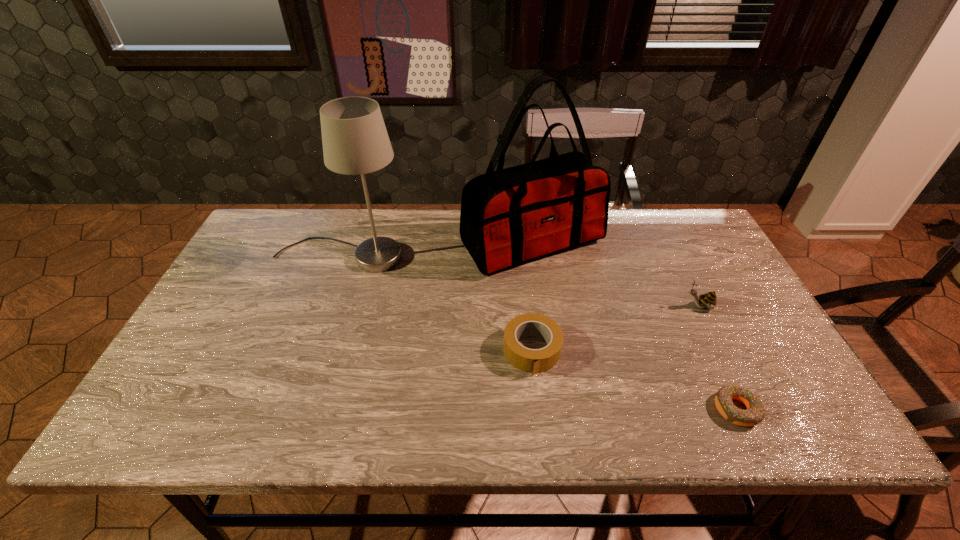
You are a GUI agent. You are given a task and a screenshot of the screen. Output one action in this format:
    pyautogui.click(x=<x>, y=<y>)
    Task: Click on the vacant position located on the face of the third nearest object
    The height and width of the screenshot is (540, 960).
    Given the screenshot: What is the action you would take?
    pyautogui.click(x=615, y=307)

Where is `vacant space located on the face of the third nearest object`? This screenshot has width=960, height=540. vacant space located on the face of the third nearest object is located at coordinates (x=560, y=307).

Image resolution: width=960 pixels, height=540 pixels. What are the coordinates of `vacant position located on the face of the third nearest object` in the screenshot? It's located at (586, 307).

Locate an element on the screen. This screenshot has height=540, width=960. free space located at the edge of the duct tape is located at coordinates (540, 425).

This screenshot has width=960, height=540. Identify the location of vacant space situated 0.370m on the left of the nearest object. (544, 409).

Identify the location of duffel bag that is at the far edge. (511, 216).

Where is `table lamp located in the far edge section of the desktop`? table lamp located in the far edge section of the desktop is located at coordinates (355, 141).

The height and width of the screenshot is (540, 960). Find the location of `object that is positioned at the near edge`. object that is positioned at the near edge is located at coordinates (x=754, y=414).

You are a GUI agent. You are given a task and a screenshot of the screen. Output one action in this format:
    pyautogui.click(x=<x>, y=<y>)
    Task: Click on the object at the left edge
    
    Given the screenshot: What is the action you would take?
    pyautogui.click(x=355, y=141)

This screenshot has width=960, height=540. Identify the location of snail that is at the right edge. (708, 300).